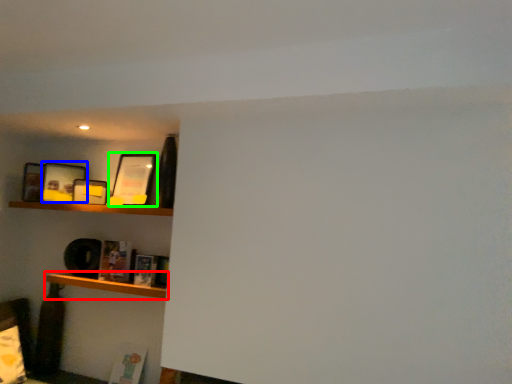
Question: Based on their relative distances, which object is farther from shelf (highlighted by a red box)? Choose from picture frame (highlighted by a blue box) and picture frame (highlighted by a green box).

Choices:
 (A) picture frame
 (B) picture frame

Answer: (B)